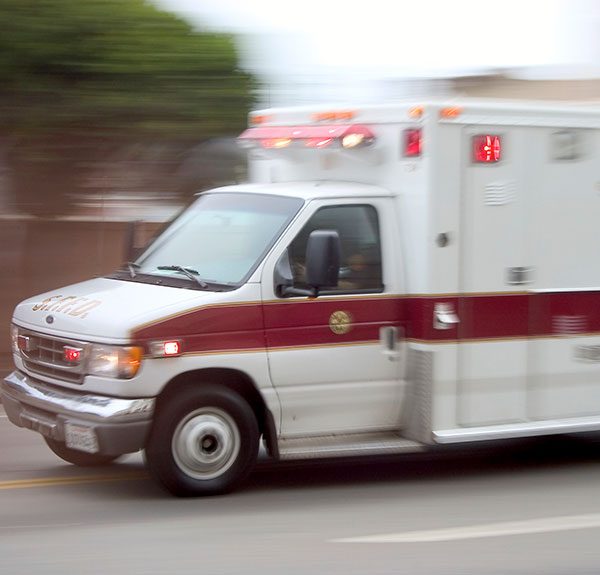
At what (x,y) coordinates should I click in order to perform the action: click on the right mirror. Please return your answer as a coordinate pair (x, y). Looking at the image, I should click on (131, 241).